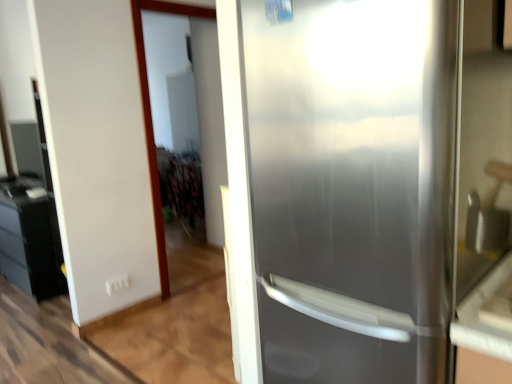
Question: From the image's perspective, is satin white screen door at upper left above or below satin silver refrigerator at right?

Choices:
 (A) below
 (B) above

Answer: (B)

Question: Based on their sizes in the image, would you say satin white screen door at upper left is bigger or smaller than satin silver refrigerator at right?

Choices:
 (A) big
 (B) small

Answer: (B)

Question: Estimate the real-world distances between objects in this image. Which object is closer to the satin white screen door at upper left?

Choices:
 (A) matte black cabinet at left
 (B) satin silver refrigerator at right

Answer: (A)

Question: Which object is the closest to the satin silver refrigerator at right?

Choices:
 (A) matte black cabinet at left
 (B) satin white screen door at upper left

Answer: (B)